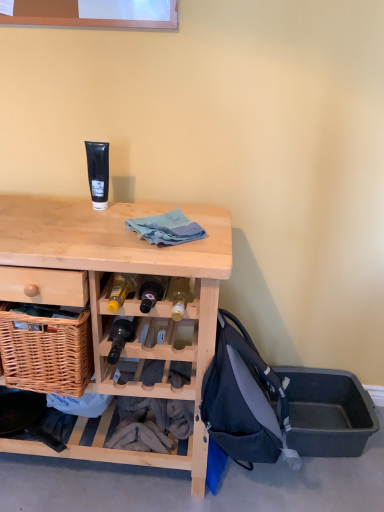
The height and width of the screenshot is (512, 384). Identify the location of vacant space in front of black matte tube at upper center. (88, 221).